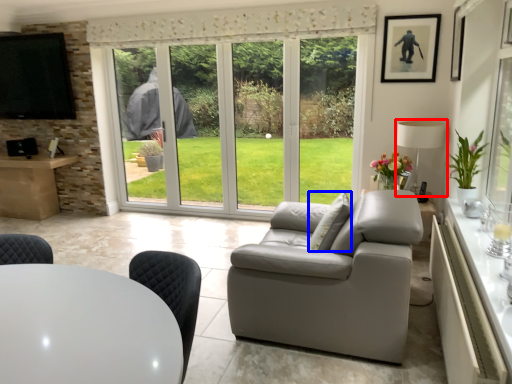
Question: Which of the following is the farthest to the observer, lamp (highlighted by a red box) or pillow (highlighted by a blue box)?

Choices:
 (A) lamp
 (B) pillow

Answer: (A)